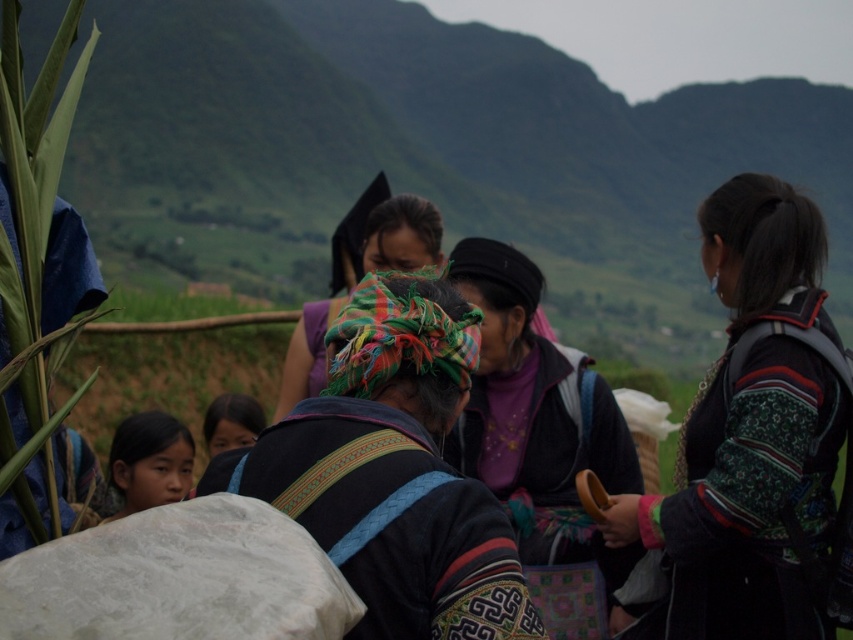
You are a photographer trying to capture the entire scene in one shot. Given that the green textured mountain at upper center and the matte black headscarf at lower center are in your viewfinder, which object would appear larger in the photo?

The green textured mountain at upper center would appear larger in the photo because it is much taller than the matte black headscarf at lower center.

You are navigating through the rural scene and want to reach a specific location. You have two points to consider, point (102,113) and point (210,458). If you are moving forward, which point will you encounter first?

Point (210,458) will be encountered first because point (102,113) is located behind it.